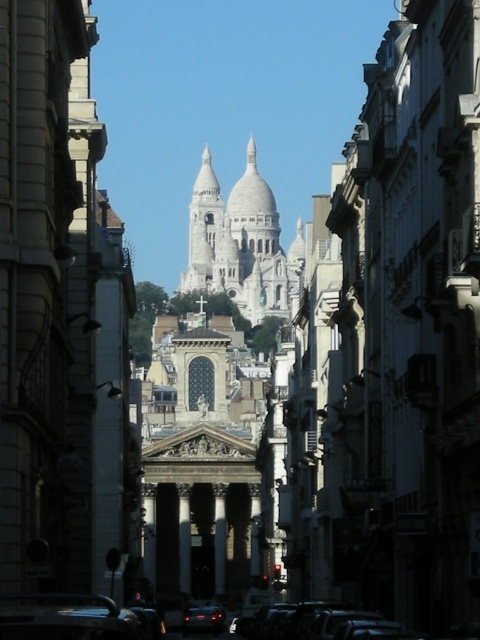
Question: Is shiny black car at lower center bigger than shiny black car at center?

Choices:
 (A) yes
 (B) no

Answer: (A)

Question: Does black glossy car at lower center have a smaller size compared to shiny black car at center?

Choices:
 (A) yes
 (B) no

Answer: (B)

Question: Which point is closer to the camera?

Choices:
 (A) pos(372,625)
 (B) pos(204,605)
 (C) pos(279,262)
 (D) pos(109,637)

Answer: (D)

Question: Which point is farther from the camera taking this photo?

Choices:
 (A) (314, 627)
 (B) (218, 627)
 (C) (96, 634)

Answer: (B)

Question: In this image, where is white stone tower at center located relative to black glossy car at lower center?

Choices:
 (A) below
 (B) above

Answer: (B)

Question: Which object is positioned farthest from the shiny black car at lower center?

Choices:
 (A) shiny black car at center
 (B) white stone tower at center

Answer: (B)